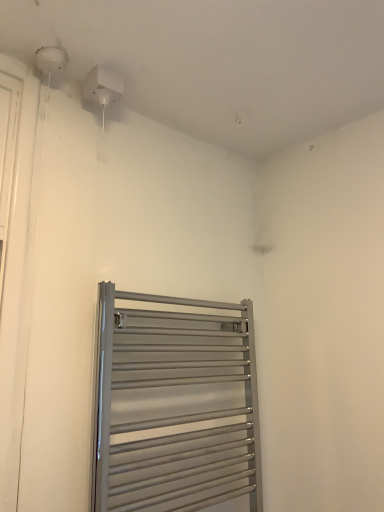
Question: Should I look upward or downward to see satin silver towel rack at lower center?

Choices:
 (A) down
 (B) up

Answer: (A)